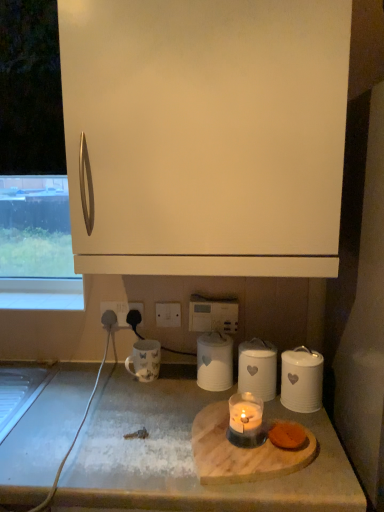
This screenshot has height=512, width=384. I want to click on free space between white ceramic canister at center, which appears as the 3th kitchen appliance when viewed from the right, and white glossy mug at lower left, so click(x=176, y=382).